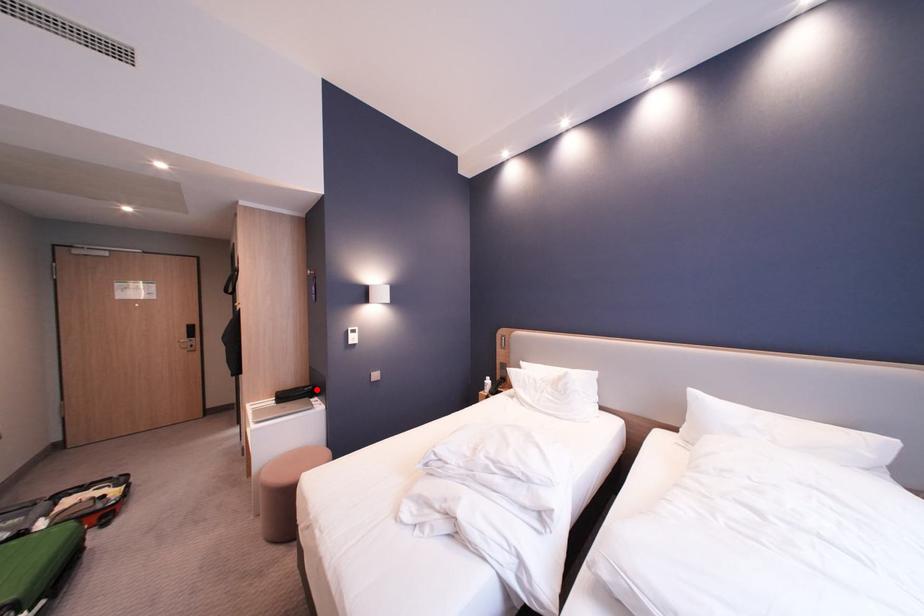
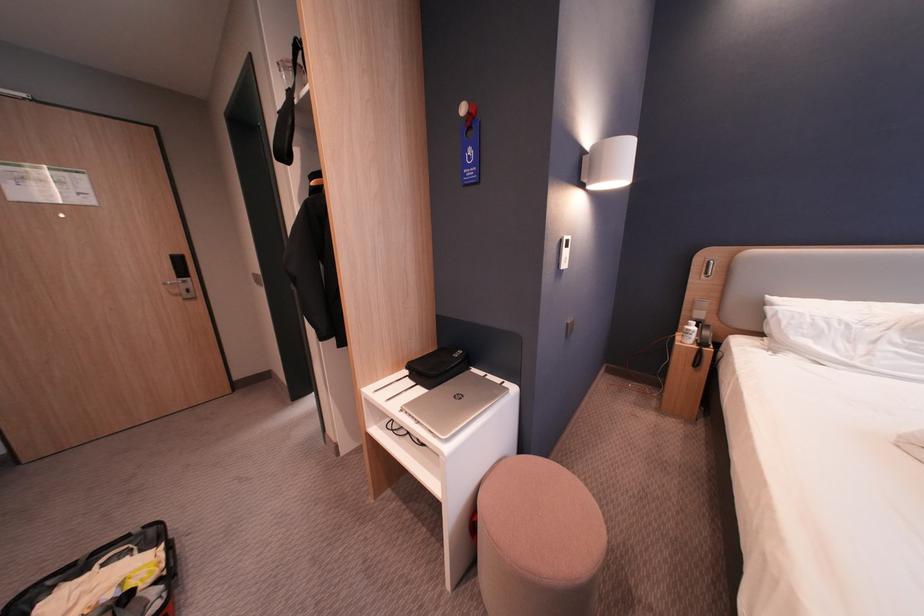
Question: I am providing you with two images of the same scene from different viewpoints. In image1, a red point is highlighted. Considering the same 3D point in image2, which of the following is correct?

Choices:
 (A) It is closer
 (B) It is farther

Answer: (A)